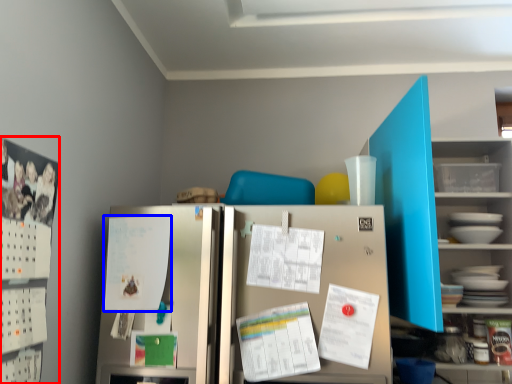
Question: Which point is further to the camera, bulletin board (highlighted by a red box) or paper (highlighted by a blue box)?

Choices:
 (A) bulletin board
 (B) paper

Answer: (B)